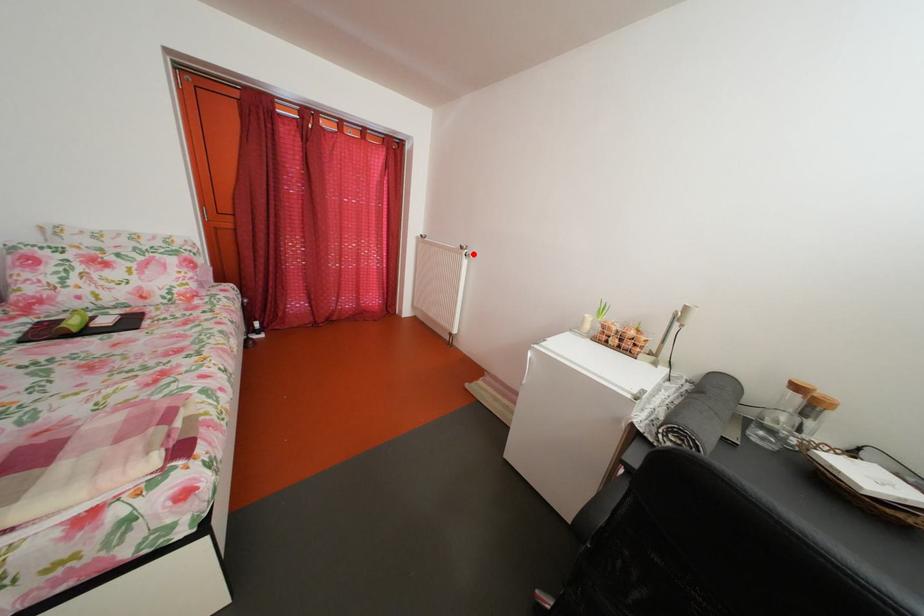
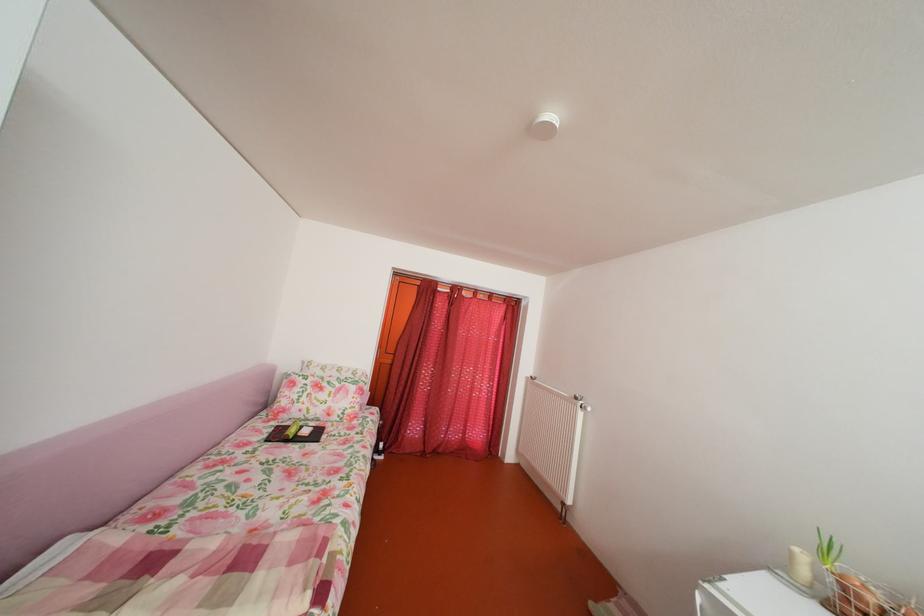
Question: I am providing you with two images of the same scene from different viewpoints. Image1 has a red point marked. In image2, the corresponding 3D location appears at what relative position? Reply with the corresponding letter.

Choices:
 (A) Closer
 (B) Farther

Answer: (B)